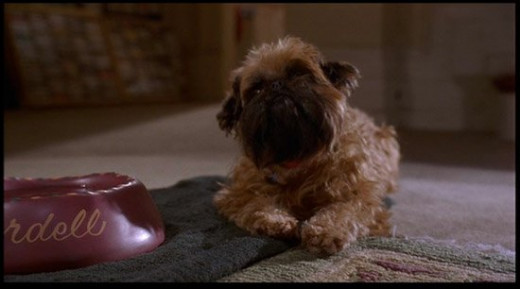
At what (x,y) coordinates should I click in order to perform the action: click on wall. Please return your answer as a coordinate pair (x, y). Looking at the image, I should click on (417, 78).